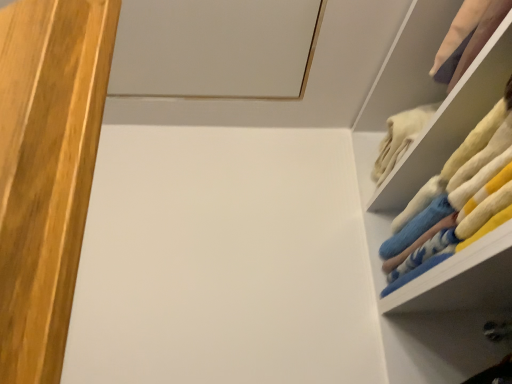
Question: Considering the relative sizes of fluffy fabric socks at right and white fluffy towels at upper right in the image provided, is fluffy fabric socks at right bigger than white fluffy towels at upper right?

Choices:
 (A) yes
 (B) no

Answer: (A)

Question: Does fluffy fabric socks at right touch white fluffy towels at upper right?

Choices:
 (A) no
 (B) yes

Answer: (A)

Question: Is fluffy fabric socks at right not within white fluffy towels at upper right?

Choices:
 (A) yes
 (B) no

Answer: (A)

Question: Is the position of fluffy fabric socks at right more distant than that of white fluffy towels at upper right?

Choices:
 (A) yes
 (B) no

Answer: (B)

Question: Considering the relative sizes of fluffy fabric socks at right and white fluffy towels at upper right in the image provided, is fluffy fabric socks at right thinner than white fluffy towels at upper right?

Choices:
 (A) no
 (B) yes

Answer: (B)

Question: From the image's perspective, would you say fluffy fabric socks at right is shown under white fluffy towels at upper right?

Choices:
 (A) yes
 (B) no

Answer: (A)

Question: Considering the relative positions of white fluffy towels at upper right and fluffy fabric socks at right in the image provided, is white fluffy towels at upper right in front of fluffy fabric socks at right?

Choices:
 (A) no
 (B) yes

Answer: (A)

Question: From the image's perspective, is white fluffy towels at upper right under fluffy fabric socks at right?

Choices:
 (A) yes
 (B) no

Answer: (B)

Question: Is white fluffy towels at upper right next to fluffy fabric socks at right and touching it?

Choices:
 (A) yes
 (B) no

Answer: (B)

Question: Is white fluffy towels at upper right not within fluffy fabric socks at right?

Choices:
 (A) yes
 (B) no

Answer: (A)

Question: Can you confirm if white fluffy towels at upper right is smaller than fluffy fabric socks at right?

Choices:
 (A) no
 (B) yes

Answer: (B)

Question: Does white fluffy towels at upper right have a greater width compared to fluffy fabric socks at right?

Choices:
 (A) no
 (B) yes

Answer: (B)

Question: Choose the correct answer: Is fluffy fabric socks at right inside white fluffy towels at upper right or outside it?

Choices:
 (A) inside
 (B) outside

Answer: (B)